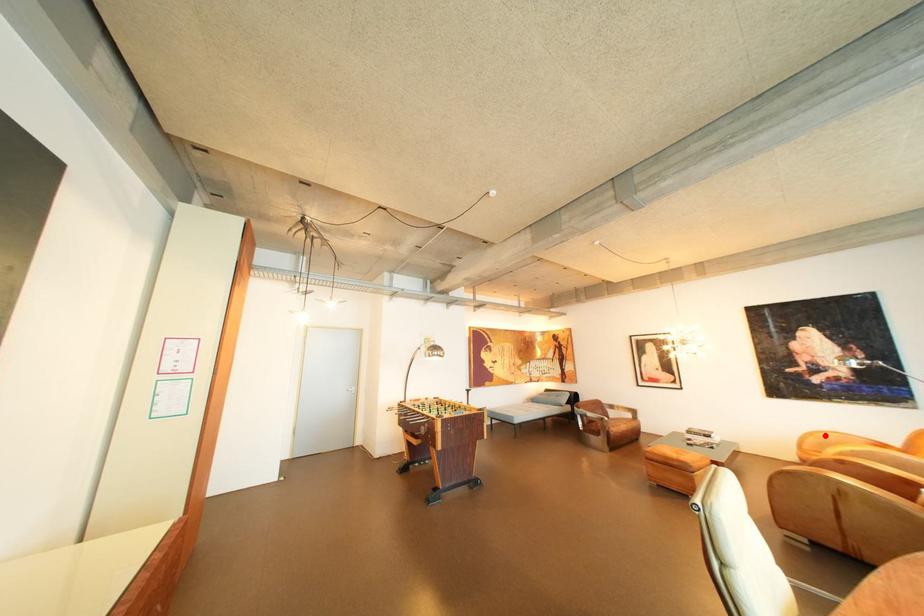
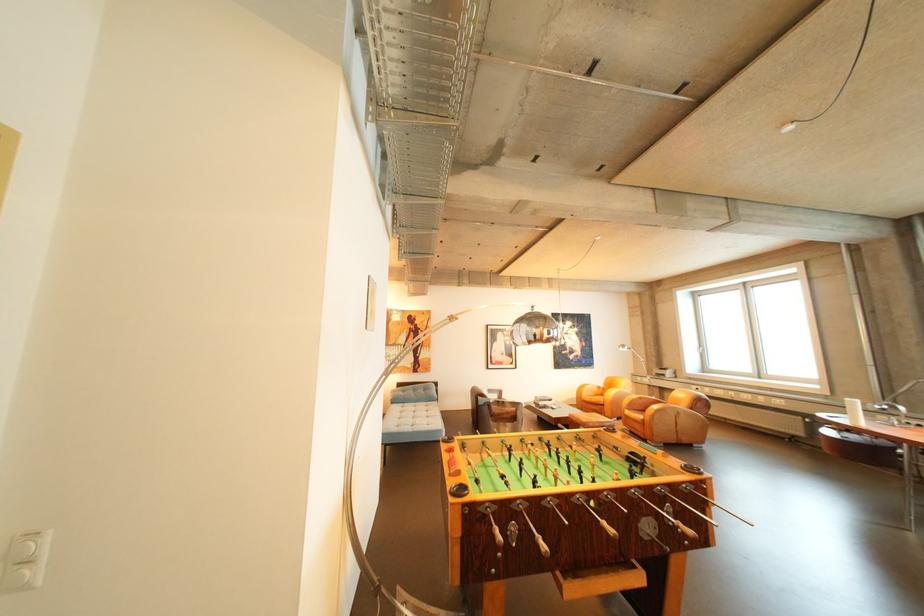
Where in the second image is the point corresponding to the highlighted location from the first image?

(594, 387)